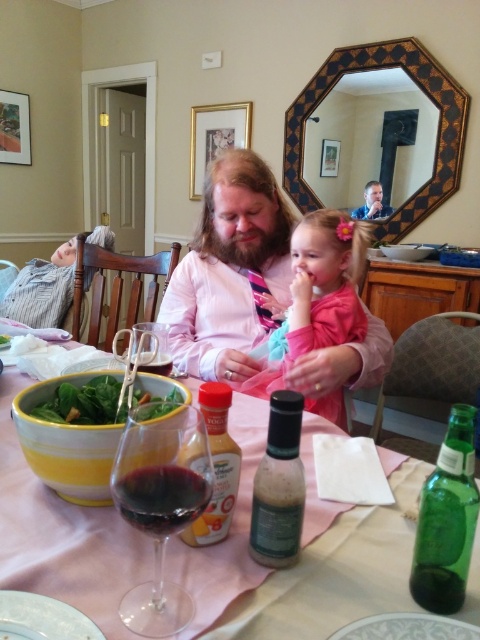
Who is more distant from viewer, [207,492] or [97,394]?

The point [97,394] is behind.

Does dark red glass at center have a greater height compared to green leafy salad at lower left?

Correct, dark red glass at center is much taller as green leafy salad at lower left.

This screenshot has width=480, height=640. I want to click on dark red glass at center, so click(x=160, y=497).

This screenshot has width=480, height=640. I want to click on dark red glass at center, so click(160, 497).

Is the position of transparent glass wine glass at center less distant than that of pink satin dress at center?

Yes, transparent glass wine glass at center is closer to the viewer.

Does transparent glass wine glass at center appear on the right side of pink satin dress at center?

Incorrect, transparent glass wine glass at center is not on the right side of pink satin dress at center.

Does point (153, 448) come closer to viewer compared to point (321, 252)?

Yes.

Where is `transparent glass wine glass at center`? The height and width of the screenshot is (640, 480). transparent glass wine glass at center is located at coordinates (160, 502).

Who is positioned more to the left, transparent glass wine glass at center or translucent plastic bottle at center?

Positioned to the left is transparent glass wine glass at center.

Does transparent glass wine glass at center have a larger size compared to translucent plastic bottle at center?

Yes.

Who is more forward, (202, 444) or (226, 480)?

Point (202, 444) is in front.

Image resolution: width=480 pixels, height=640 pixels. Identify the location of transparent glass wine glass at center. (160, 502).